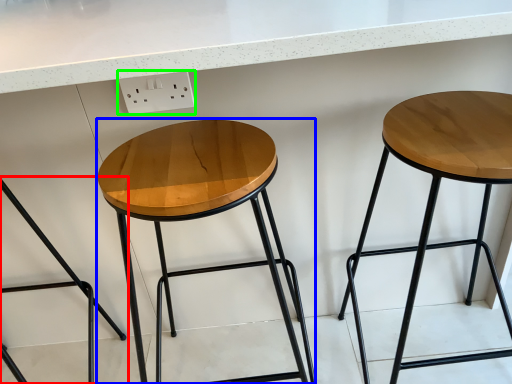
Question: Considering the real-world distances, which object is closest to stool (highlighted by a red box)? stool (highlighted by a blue box) or electric outlet (highlighted by a green box).

Choices:
 (A) stool
 (B) electric outlet

Answer: (A)